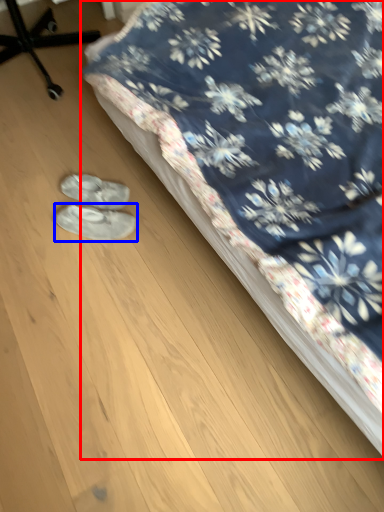
Question: Among these objects, which one is farthest to the camera, bed (highlighted by a red box) or footwear (highlighted by a blue box)?

Choices:
 (A) bed
 (B) footwear

Answer: (B)